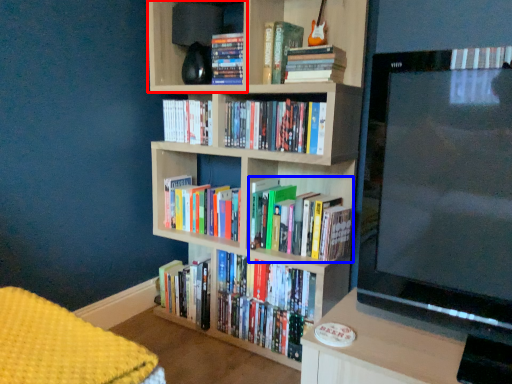
Question: Among these objects, which one is nearest to the camera, shelf (highlighted by a red box) or book (highlighted by a blue box)?

Choices:
 (A) shelf
 (B) book

Answer: (B)